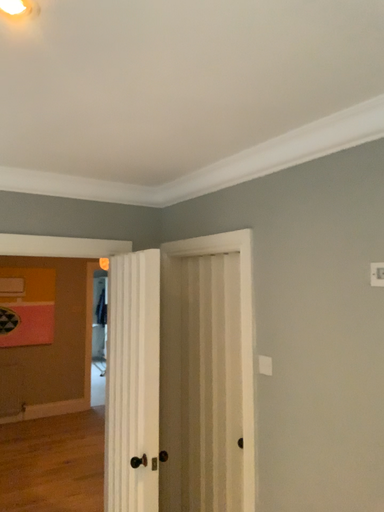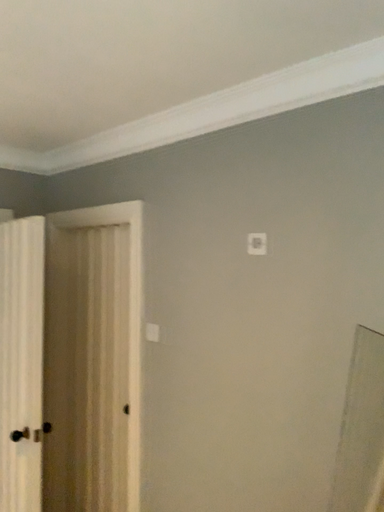
Question: How did the camera likely rotate when shooting the video?

Choices:
 (A) rotated right
 (B) rotated left

Answer: (A)